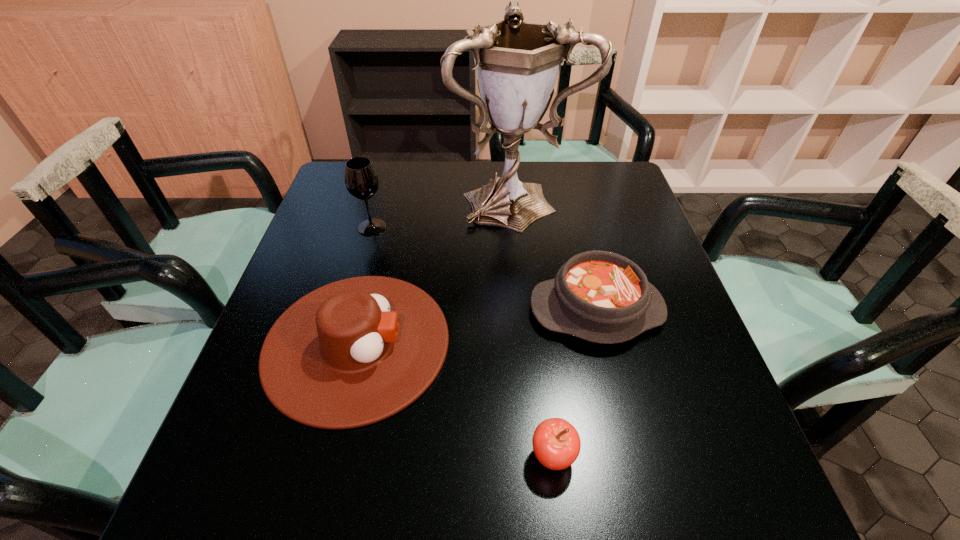
At what (x,y) coordinates should I click in order to perform the action: click on object present at the far edge. Please return your answer as a coordinate pair (x, y). The image size is (960, 540). Looking at the image, I should click on (517, 63).

The height and width of the screenshot is (540, 960). Identify the location of object that is positioned at the near edge. (556, 443).

You are a GUI agent. You are given a task and a screenshot of the screen. Output one action in this format:
    pyautogui.click(x=<x>, y=<y>)
    Task: Click on the wineglass that is at the left edge
    Image resolution: width=960 pixels, height=540 pixels.
    Given the screenshot: What is the action you would take?
    pyautogui.click(x=361, y=180)

This screenshot has height=540, width=960. What are the coordinates of `cowboy hat that is positioned at the left edge` in the screenshot? It's located at (351, 353).

Find the location of `object that is at the right edge`. object that is at the right edge is located at coordinates (599, 296).

In the image, there is a desktop. Where is `vacant space at the far edge`? The width and height of the screenshot is (960, 540). vacant space at the far edge is located at coordinates coord(552,190).

Identify the location of vacant space at the near edge of the desktop. (300, 514).

What are the coordinates of `vacant area at the left edge of the desktop` in the screenshot? It's located at (309, 445).

This screenshot has height=540, width=960. Identify the location of free space at the right edge of the desktop. (644, 227).

What are the coordinates of `vacant region at the far right corner` in the screenshot? It's located at (573, 163).